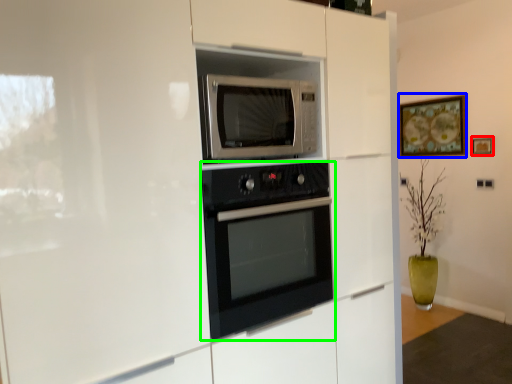
Question: Based on their relative distances, which object is nearer to picture frame (highlighted by a red box)? Choose from picture frame (highlighted by a blue box) and oven (highlighted by a green box).

Choices:
 (A) picture frame
 (B) oven

Answer: (A)